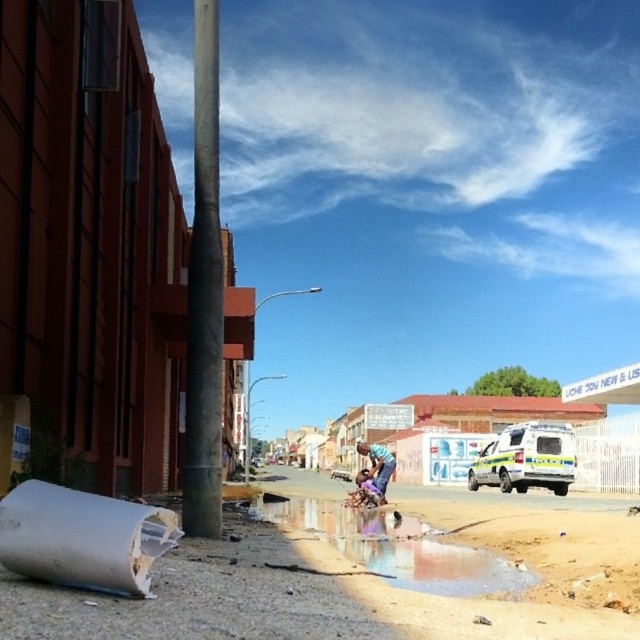
Question: Does reflective wet surface at lower center come in front of blue denim shorts at center?

Choices:
 (A) no
 (B) yes

Answer: (B)

Question: Which is farther from the blue denim shorts at center?

Choices:
 (A) reflective wet surface at lower center
 (B) yellow-green plastic ambulance at center-right
 (C) smooth concrete pole at left

Answer: (B)

Question: Which point is closer to the camera taking this photo?

Choices:
 (A) (348, 500)
 (B) (392, 465)

Answer: (B)

Question: Is reflective wet surface at lower center to the left of blue denim shorts at center from the viewer's perspective?

Choices:
 (A) yes
 (B) no

Answer: (A)

Question: Does smooth concrete pole at left appear over blue denim shorts at center?

Choices:
 (A) no
 (B) yes

Answer: (B)

Question: Which is farther from the reflective wet surface at lower center?

Choices:
 (A) blue denim shorts at center
 (B) smooth concrete pole at left

Answer: (B)